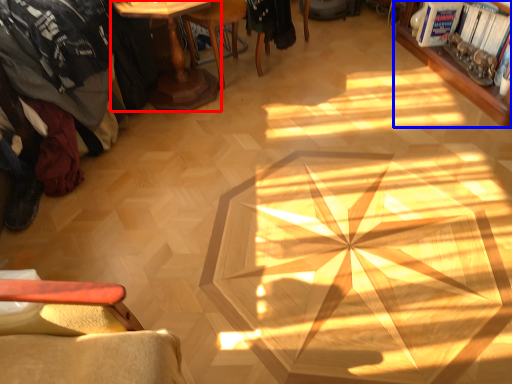
Question: Which object appears farthest to the camera in this image, table (highlighted by a red box) or bookcase (highlighted by a blue box)?

Choices:
 (A) table
 (B) bookcase

Answer: (B)